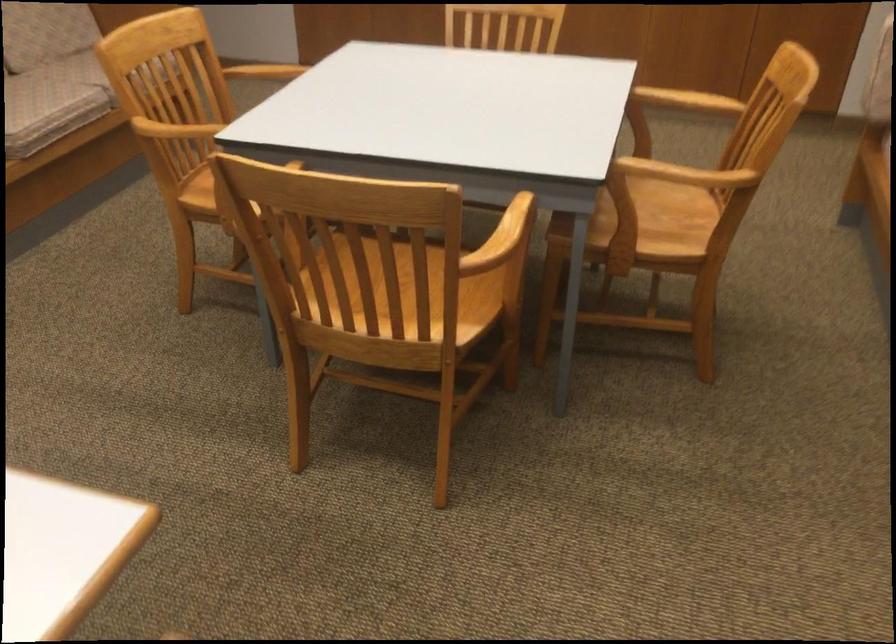
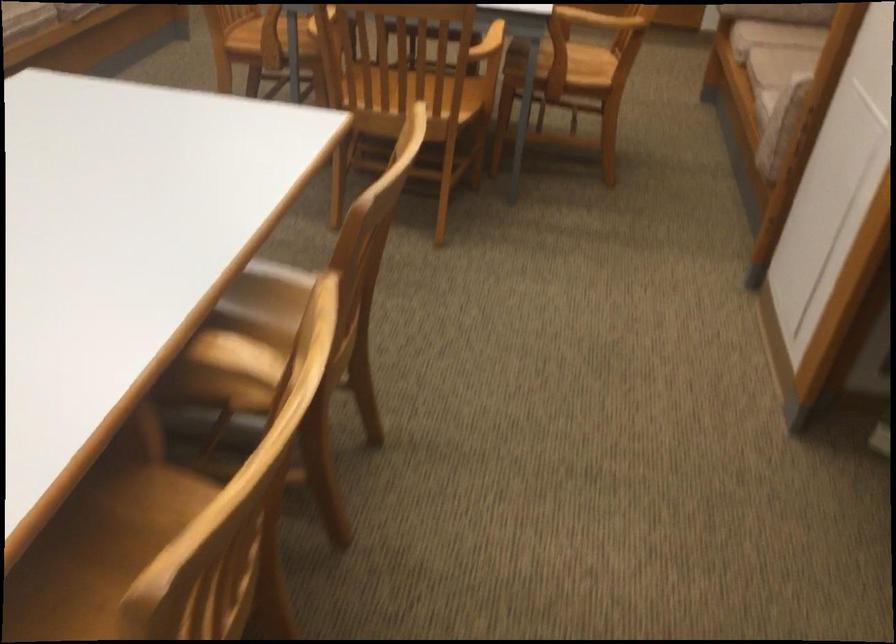
In the second image, find the point that corresponds to point (645, 237) in the first image.

(570, 69)